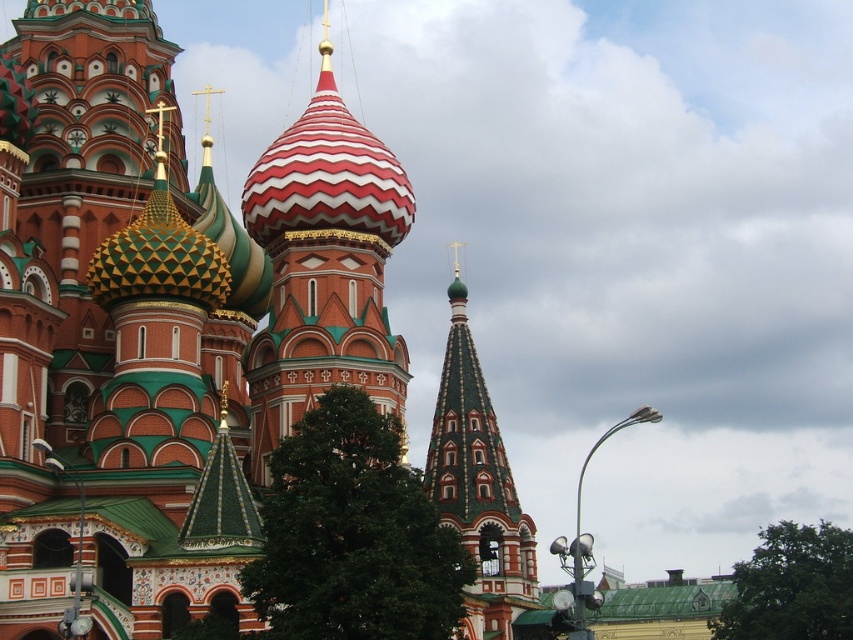
Question: Among these objects, which one is farthest from the camera?

Choices:
 (A) red and white striped dome at center
 (B) green mosaic dome at center
 (C) polychrome mosaic dome at center

Answer: (A)

Question: Is red and white striped dome at center bigger than green mosaic dome at center?

Choices:
 (A) no
 (B) yes

Answer: (B)

Question: Estimate the real-world distances between objects in this image. Which object is closer to the red and white striped dome at center?

Choices:
 (A) green mosaic dome at center
 (B) polychrome mosaic dome at center

Answer: (B)

Question: Does red and white striped dome at center appear on the left side of green mosaic dome at center?

Choices:
 (A) yes
 (B) no

Answer: (A)

Question: Does polychrome mosaic dome at center appear under green mosaic dome at center?

Choices:
 (A) yes
 (B) no

Answer: (B)

Question: Which is nearer to the green mosaic dome at center?

Choices:
 (A) polychrome mosaic dome at center
 (B) red and white striped dome at center

Answer: (A)